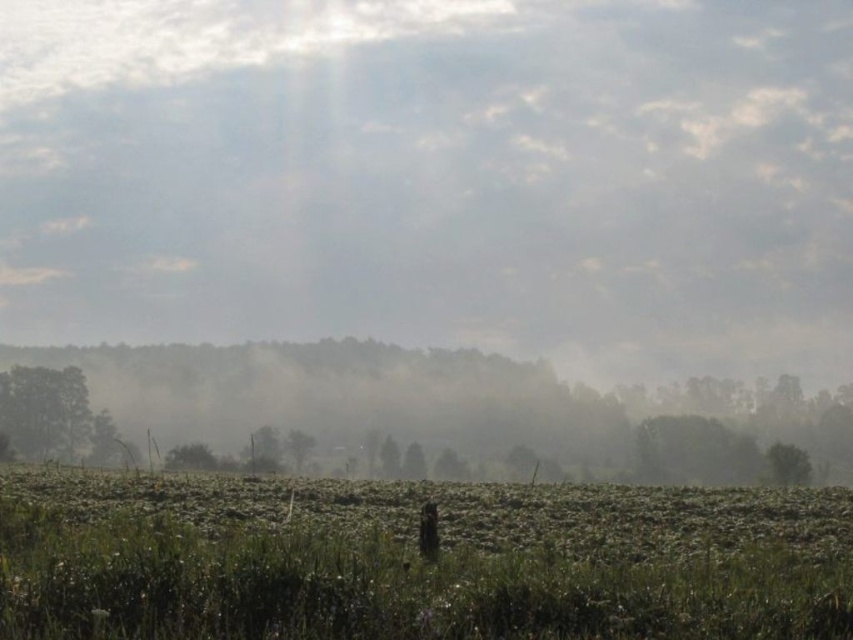
Question: Does foggy mist at center have a smaller size compared to green matte grass at lower center?

Choices:
 (A) yes
 (B) no

Answer: (B)

Question: Which point appears farthest from the camera in this image?

Choices:
 (A) (260, 275)
 (B) (140, 508)

Answer: (A)

Question: Is the position of foggy mist at center more distant than that of green matte grass at lower center?

Choices:
 (A) yes
 (B) no

Answer: (A)

Question: Does foggy mist at center appear on the right side of green matte grass at lower center?

Choices:
 (A) yes
 (B) no

Answer: (B)

Question: Which object is farther from the camera taking this photo?

Choices:
 (A) green matte grass at lower center
 (B) foggy mist at center

Answer: (B)